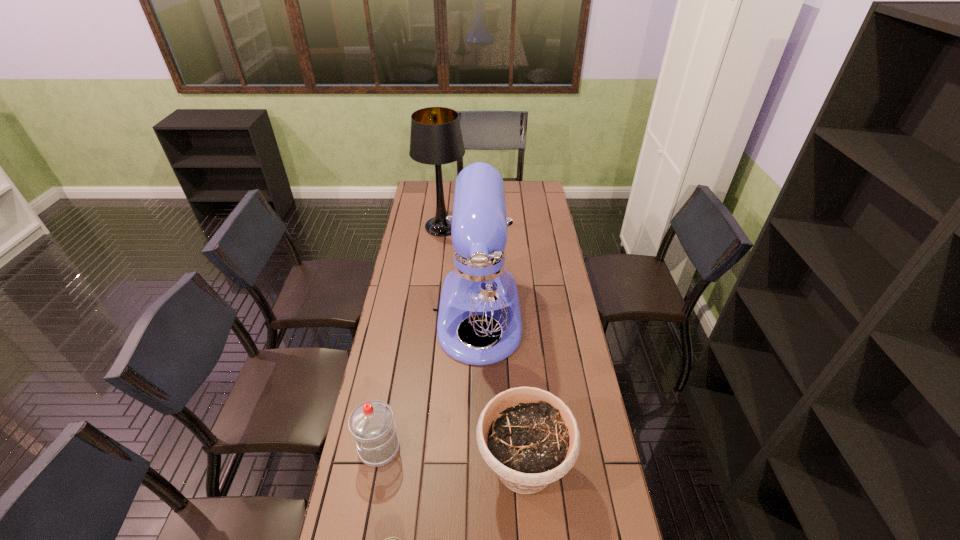
This screenshot has height=540, width=960. Find the location of `the farthest object`. the farthest object is located at coordinates (436, 138).

Where is `mixer`? mixer is located at coordinates (479, 290).

At what (x,y) coordinates should I click in order to perform the action: click on flowerpot. Please return your answer as a coordinate pair (x, y). Image resolution: width=960 pixels, height=540 pixels. Looking at the image, I should click on (528, 436).

Where is `water bottle`? The height and width of the screenshot is (540, 960). water bottle is located at coordinates (372, 425).

Image resolution: width=960 pixels, height=540 pixels. In order to click on vacant point located 0.230m on the back of the farthest object in this screenshot , I will do `click(446, 192)`.

Identify the location of free location located at the mixing area of the mixer. pos(479,470).

Where is `free location located on the back of the flowerpot`? free location located on the back of the flowerpot is located at coordinates (515, 355).

Where is `table lamp present at the left edge`? The image size is (960, 540). table lamp present at the left edge is located at coordinates (436, 138).

This screenshot has width=960, height=540. Identify the location of water bottle located in the left edge section of the desktop. (372, 425).

This screenshot has height=540, width=960. What are the coordinates of `object present at the right edge` in the screenshot? It's located at (528, 436).